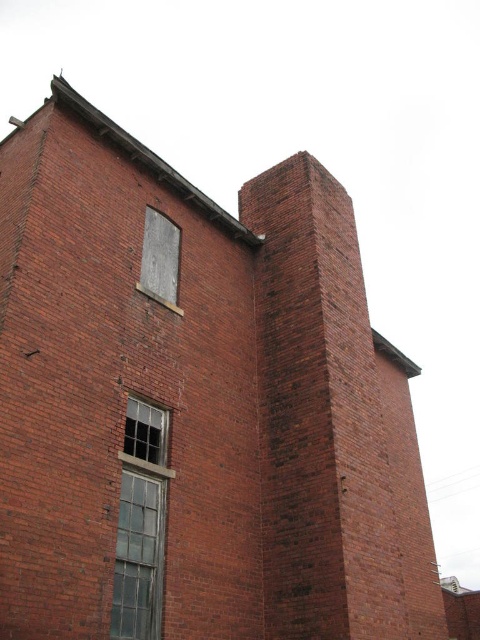
Which is above, clear glass window at center or gray concrete window at upper center?

Positioned higher is gray concrete window at upper center.

Between clear glass window at center and gray concrete window at upper center, which one is positioned lower?

Positioned lower is clear glass window at center.

Find the location of a particular element. This screenshot has height=640, width=480. clear glass window at center is located at coordinates (141, 524).